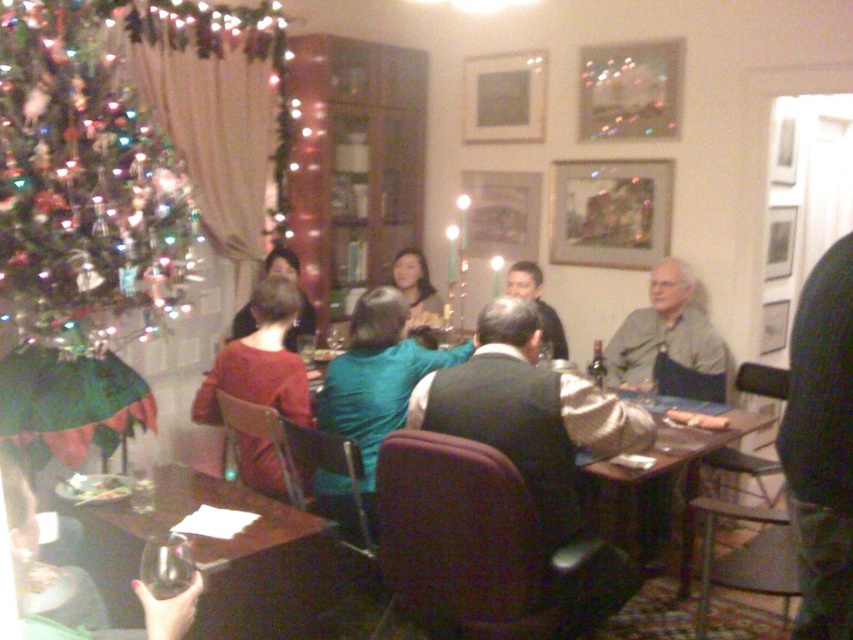
Does wooden table at center come in front of teal fabric shirt at center?

Yes, it is in front of teal fabric shirt at center.

Who is more forward, (723, 428) or (241, 333)?

Point (723, 428) is more forward.

The image size is (853, 640). What are the coordinates of `wooden table at center` in the screenshot? It's located at (663, 476).

In the scene shown: Which is more to the right, green matte christmas tree at left or teal fabric shirt at center?

teal fabric shirt at center

Between point (99, 161) and point (310, 320), which one is positioned in front?

Point (99, 161) is in front.

Image resolution: width=853 pixels, height=640 pixels. In order to click on green matte christmas tree at left in this screenshot , I will do `click(82, 184)`.

Where is `green matte christmas tree at left`? green matte christmas tree at left is located at coordinates (82, 184).

Between dark blue sweater at center and wooden table at center, which one appears on the right side from the viewer's perspective?

wooden table at center

Does dark blue sweater at center appear on the right side of wooden table at center?

Incorrect, dark blue sweater at center is not on the right side of wooden table at center.

This screenshot has width=853, height=640. Describe the element at coordinates (821, 444) in the screenshot. I see `dark blue sweater at center` at that location.

Find the location of a particular element. The height and width of the screenshot is (640, 853). dark blue sweater at center is located at coordinates (821, 444).